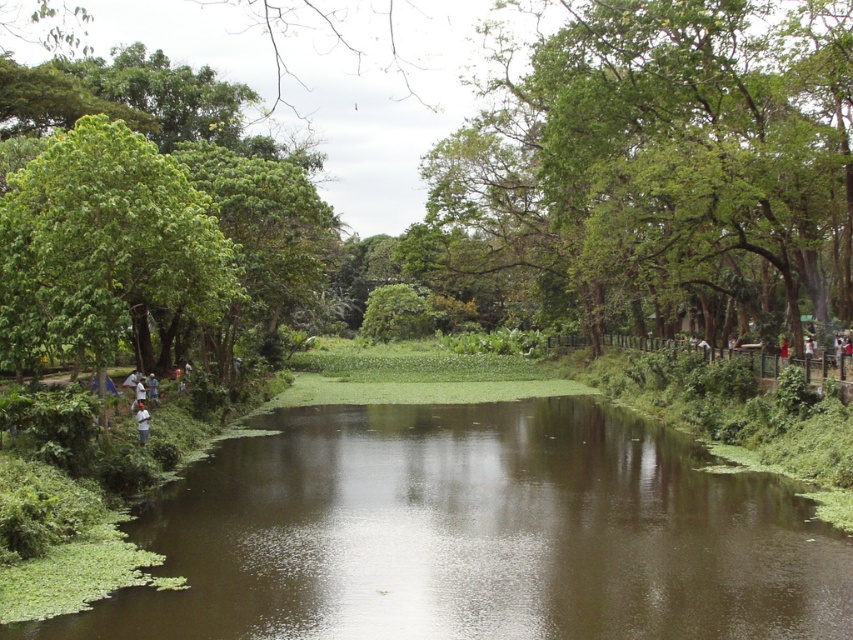
Does green leafy tree at left appear under white cotton shirt at lower left?

No.

Does point (18, 284) come in front of point (138, 442)?

Yes, it is in front of point (138, 442).

Describe the element at coordinates (103, 248) in the screenshot. I see `green leafy tree at left` at that location.

The width and height of the screenshot is (853, 640). I want to click on green leafy tree at left, so click(x=103, y=248).

Which is in front, point (596, 627) or point (3, 268)?

Positioned in front is point (596, 627).

Does point (223, 500) lie in front of point (16, 243)?

Yes, point (223, 500) is closer to viewer.

Is point (431, 436) closer to viewer compared to point (202, 211)?

No, (431, 436) is further to viewer.

This screenshot has width=853, height=640. In order to click on brown murky water at center in this screenshot , I will do `click(474, 534)`.

Does brown murky water at center have a lesser width compared to green leafy tree at upper center?

Correct, brown murky water at center's width is less than green leafy tree at upper center's.

Who is more distant from viewer, (561, 509) or (845, 312)?

Positioned behind is point (845, 312).

Where is `brown murky water at center`? brown murky water at center is located at coordinates 474,534.